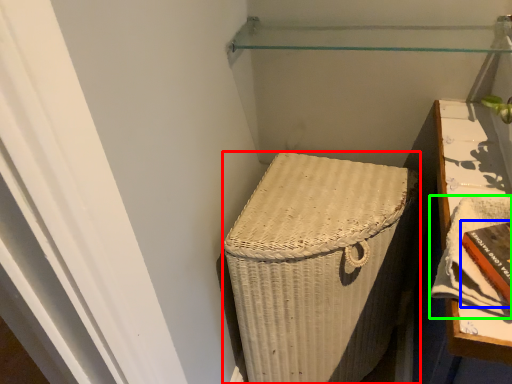
Question: Which is farther away from furniture (highlighted by a red box)? book (highlighted by a blue box) or book (highlighted by a green box)?

Choices:
 (A) book
 (B) book

Answer: (A)